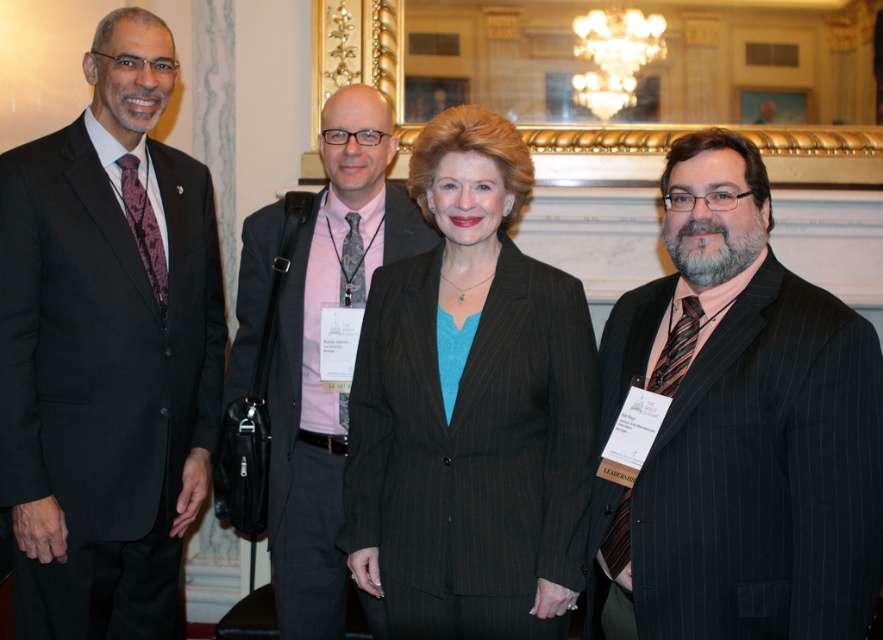
You are organizing a photo shoot and need to arrange the matte black suit at left and the pink fabric shirt at center based on their widths. Which one should you place on the narrower side of the frame?

The matte black suit at left has a lesser width compared to the pink fabric shirt at center, so you should place the matte black suit at left on the narrower side of the frame.

You are a photographer at the event and need to capture a photo of the matte black suit at left and the pink fabric shirt at center. Based on their positions, which one is higher in the frame?

The matte black suit at left is higher in the frame than the pink fabric shirt at center according to the description.